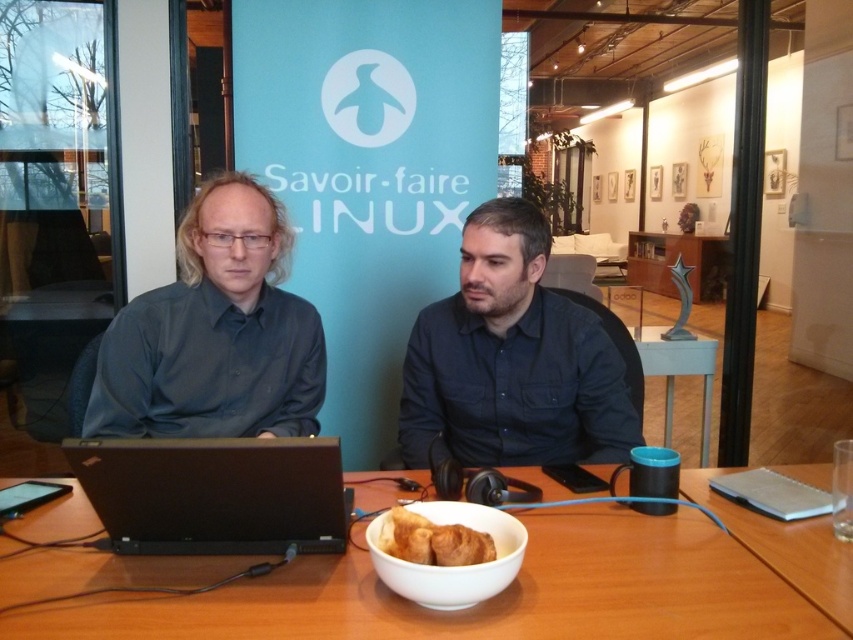
Question: Which point is closer to the camera taking this photo?

Choices:
 (A) (306, 540)
 (B) (373, 602)

Answer: (B)

Question: Does wooden table at center have a lesser width compared to golden brown croissant at center?

Choices:
 (A) no
 (B) yes

Answer: (A)

Question: Is dark blue shirt at left positioned behind white glossy bowl at lower center?

Choices:
 (A) no
 (B) yes

Answer: (B)

Question: Among these objects, which one is nearest to the camera?

Choices:
 (A) white glossy bowl at lower center
 (B) blue plastic cup at lower right
 (C) dark blue shirt at left
 (D) golden brown croissant at center

Answer: (A)

Question: Can you confirm if wooden table at center is positioned to the right of black matte laptop at center?

Choices:
 (A) no
 (B) yes

Answer: (B)

Question: Among these objects, which one is farthest from the camera?

Choices:
 (A) blue plastic cup at lower right
 (B) dark blue shirt at left
 (C) white glossy bowl at lower center
 (D) wooden table at center

Answer: (A)